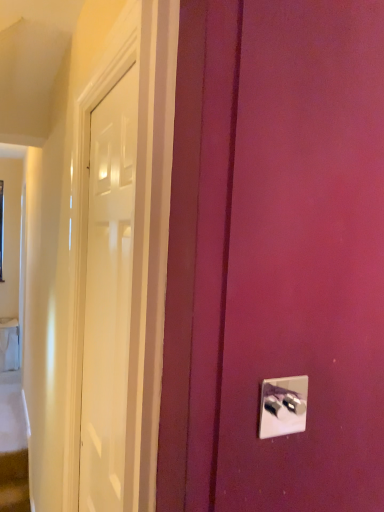
Question: From the image's perspective, is white glossy door at left located above or below metallic silver light switch at lower right?

Choices:
 (A) below
 (B) above

Answer: (A)

Question: Considering the positions of white glossy door at left and metallic silver light switch at lower right in the image, is white glossy door at left bigger or smaller than metallic silver light switch at lower right?

Choices:
 (A) big
 (B) small

Answer: (A)

Question: In terms of height, does white glossy door at left look taller or shorter compared to metallic silver light switch at lower right?

Choices:
 (A) short
 (B) tall

Answer: (B)

Question: Is metallic silver light switch at lower right to the left or to the right of white glossy door at left in the image?

Choices:
 (A) left
 (B) right

Answer: (B)

Question: From a real-world perspective, is metallic silver light switch at lower right physically located above or below white glossy door at left?

Choices:
 (A) above
 (B) below

Answer: (A)

Question: Considering the positions of metallic silver light switch at lower right and white glossy door at left in the image, is metallic silver light switch at lower right bigger or smaller than white glossy door at left?

Choices:
 (A) big
 (B) small

Answer: (B)

Question: Is metallic silver light switch at lower right situated inside white glossy door at left or outside?

Choices:
 (A) inside
 (B) outside

Answer: (B)